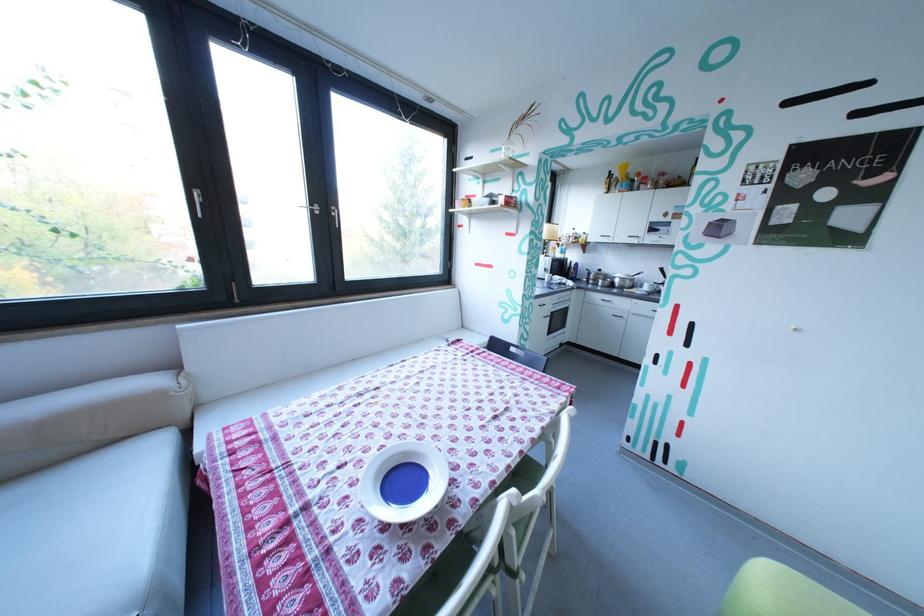
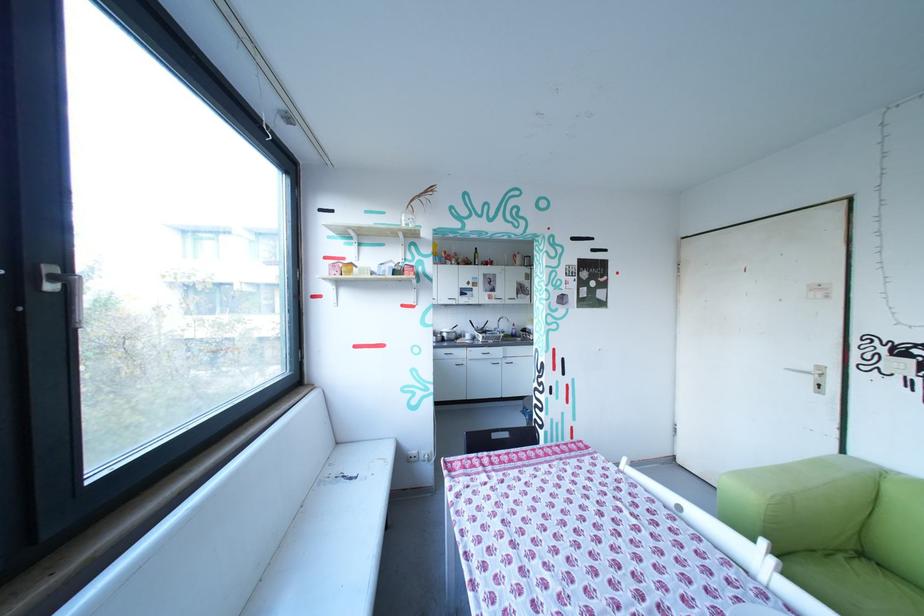
Locate, in the second image, the point that corresponds to [538,191] in the first image.

(433, 262)